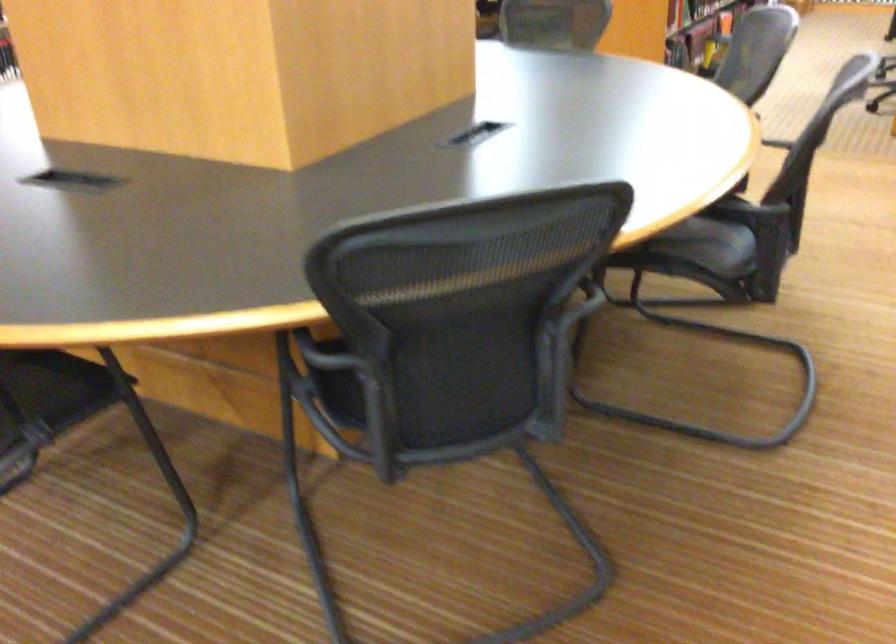
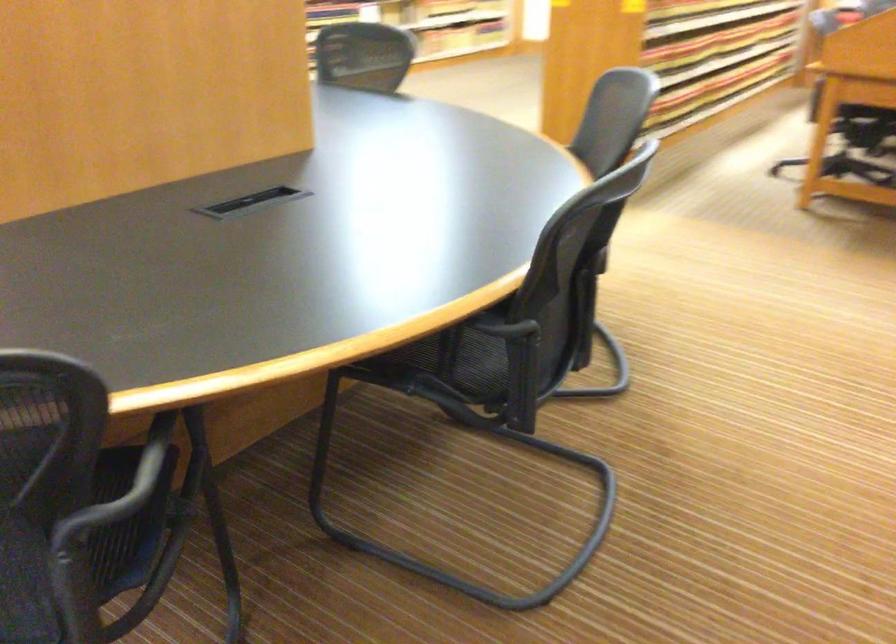
Question: How did the camera likely rotate?

Choices:
 (A) Left
 (B) Right
 (C) Up
 (D) Down

Answer: (C)